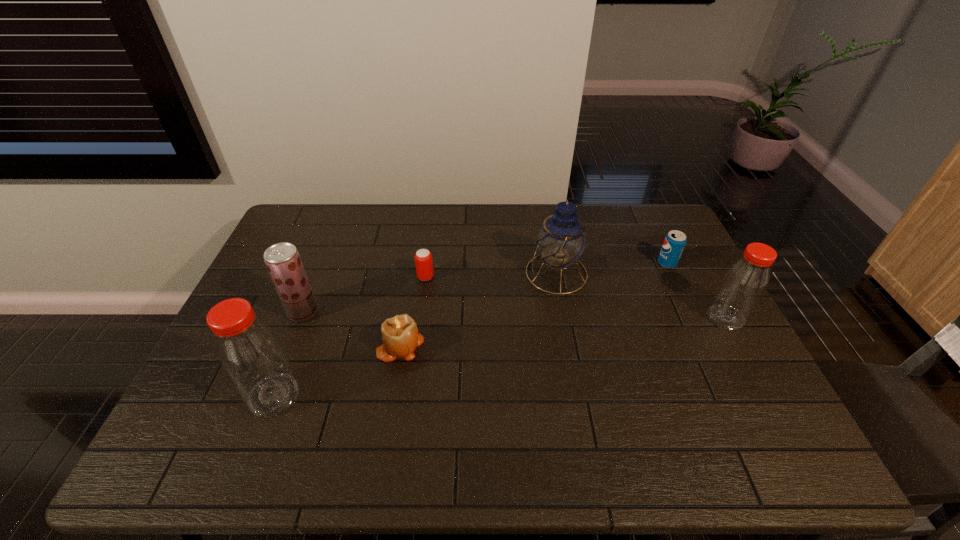
If we want them evenly spaced by inserting an extra bottle among them, please locate a free spot for this new bottle. Please provide its 2D coordinates. Your answer should be formatted as a tuple, i.e. [(x, y)], where the tuple contains the x and y coordinates of a point satisfying the conditions above.

[(517, 353)]